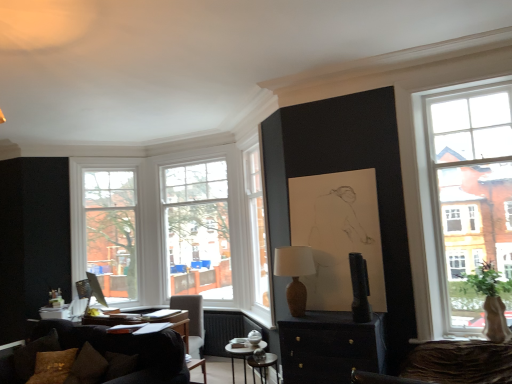
This screenshot has height=384, width=512. What do you see at coordinates (359, 288) in the screenshot?
I see `black glossy television at center` at bounding box center [359, 288].

Where is `black glossy television at center`? The image size is (512, 384). black glossy television at center is located at coordinates (359, 288).

In order to face clear glass window at left, marked as the 1th window in a left-to-right arrangement, should I rotate leftwards or rightwards?

Rotate left and turn 18.531 degrees.

Image resolution: width=512 pixels, height=384 pixels. In order to click on black glossy television at center in this screenshot , I will do `click(359, 288)`.

Between point (144, 357) and point (223, 267), which one is positioned behind?

The point (223, 267) is farther.

Locate an element on the screen. The width and height of the screenshot is (512, 384). studio couch below the clear glass window at center, which is the 2th window from left to right (from the image's perspective) is located at coordinates (127, 350).

Which object is thinner, dark brown fabric couch at lower left or clear glass window at center, which ranks as the 1th window in right-to-left order?

Thinner between the two is clear glass window at center, which ranks as the 1th window in right-to-left order.

Considering the relative sizes of dark brown fabric couch at lower left and clear glass window at center, which is the 2th window from left to right, in the image provided, is dark brown fabric couch at lower left shorter than clear glass window at center, which is the 2th window from left to right,?

Yes, dark brown fabric couch at lower left is shorter than clear glass window at center, which is the 2th window from left to right.

Is dark brown leather chair at center not inside matte brown vase at center?

dark brown leather chair at center is positioned outside matte brown vase at center.

Considering the sizes of dark brown leather chair at center and matte brown vase at center in the image, is dark brown leather chair at center taller or shorter than matte brown vase at center?

Clearly, dark brown leather chair at center is taller compared to matte brown vase at center.

From the picture: Which object is positioned more to the right, dark brown leather chair at center or matte brown vase at center?

matte brown vase at center.

Who is taller, matte black cabinet at center or clear glass window at left, which is counted as the 2th window, starting from the right?

Standing taller between the two is clear glass window at left, which is counted as the 2th window, starting from the right.

From the image's perspective, would you say matte black cabinet at center is positioned over clear glass window at left, which is counted as the 2th window, starting from the right?

No, from the image's perspective, matte black cabinet at center is not above clear glass window at left, which is counted as the 2th window, starting from the right.

Could you tell me if matte black cabinet at center is turned towards clear glass window at left, marked as the 1th window in a left-to-right arrangement?

No, matte black cabinet at center is not aimed at clear glass window at left, marked as the 1th window in a left-to-right arrangement.

This screenshot has height=384, width=512. There is a matte black cabinet at center. Identify the location of the 2nd window above it (from a real-world perspective). (105, 226).

Considering the positions of objects matte black cabinet at center and green leafy plant at right in the image provided, who is behind, matte black cabinet at center or green leafy plant at right?

matte black cabinet at center is more distant.

Is matte black cabinet at center to the left of green leafy plant at right from the viewer's perspective?

Yes.

Considering the sizes of matte black cabinet at center and green leafy plant at right in the image, is matte black cabinet at center wider or thinner than green leafy plant at right?

In the image, matte black cabinet at center appears to be wider than green leafy plant at right.

Is matte brown vase at center touching metallic silver side table at center?

matte brown vase at center and metallic silver side table at center are clearly separated.

Would you say metallic silver side table at center is part of matte brown vase at center's contents?

No, metallic silver side table at center is located outside of matte brown vase at center.

Looking at this image, is matte brown vase at center positioned before metallic silver side table at center?

Yes, it is in front of metallic silver side table at center.

Is point (113, 281) positioned after point (20, 358)?

Yes, it is behind point (20, 358).

Is clear glass window at left, marked as the 1th window in a left-to-right arrangement, further to camera compared to brown textured pillow at lower left?

Yes, it is.

In terms of height, does clear glass window at left, which is counted as the 2th window, starting from the right, look taller or shorter compared to brown textured pillow at lower left?

In the image, clear glass window at left, which is counted as the 2th window, starting from the right, appears to be taller than brown textured pillow at lower left.

At what (x,y) coordinates should I click in order to perform the action: click on pillow below the clear glass window at left, which is counted as the 2th window, starting from the right (from a real-world perspective). Please return your answer as a coordinate pair (x, y). The image size is (512, 384). Looking at the image, I should click on (33, 354).

From the image's perspective, who appears lower, metallic silver side table at center or green leafy plant at right?

From the image's view, metallic silver side table at center is below.

How far apart are metallic silver side table at center and green leafy plant at right?

The distance of metallic silver side table at center from green leafy plant at right is 2.07 meters.

Looking at this image, is metallic silver side table at center taller or shorter than green leafy plant at right?

In the image, metallic silver side table at center appears to be shorter than green leafy plant at right.

Based on the photo, choose the correct answer: Is metallic silver side table at center inside green leafy plant at right or outside it?

metallic silver side table at center is not inside green leafy plant at right, it's outside.

Locate an element on the screen. studio couch that is in front of the clear glass window at center, which is the 2th window from left to right is located at coordinates pyautogui.click(x=127, y=350).

Where is `chair located below the matte brown vase at center (from the image's perspective)`? The height and width of the screenshot is (384, 512). chair located below the matte brown vase at center (from the image's perspective) is located at coordinates (192, 327).

Which object lies further to the anchor point metallic silver side table at center, matte black cabinet at center or black glossy television at center?

Among the two, black glossy television at center is located further to metallic silver side table at center.

Which object lies further to the anchor point dark brown fabric couch at lower left, dark brown leather chair at center or clear glass window at center, which ranks as the 1th window in right-to-left order?

clear glass window at center, which ranks as the 1th window in right-to-left order, is further to dark brown fabric couch at lower left.

Which object lies further to the anchor point clear glass window at left, marked as the 1th window in a left-to-right arrangement, brown textured pillow at lower left or matte black cabinet at center?

Based on the image, matte black cabinet at center appears to be further to clear glass window at left, marked as the 1th window in a left-to-right arrangement.

From the image, which object appears to be nearer to black glossy television at center, brown textured pillow at lower left or matte brown vase at center?

The object closer to black glossy television at center is matte brown vase at center.

When comparing their distances from clear glass window at center, which ranks as the 1th window in right-to-left order, does brown textured pillow at lower left or metallic silver side table at center seem closer?

metallic silver side table at center is positioned closer to the anchor clear glass window at center, which ranks as the 1th window in right-to-left order.

From the image, which object appears to be farther from matte brown vase at center, dark brown fabric couch at lower left or black glossy television at center?

Among the two, dark brown fabric couch at lower left is located further to matte brown vase at center.

Estimate the real-world distances between objects in this image. Which object is further from matte brown vase at center, green leafy plant at right or metallic silver side table at center?

Among the two, green leafy plant at right is located further to matte brown vase at center.

Based on their spatial positions, is green leafy plant at right or matte brown vase at center further from matte black cabinet at center?

green leafy plant at right.

Locate an element on the screen. The width and height of the screenshot is (512, 384). lamp between black glossy television at center and metallic silver side table at center in the up-down direction is located at coordinates (295, 274).

Locate an element on the screen. The height and width of the screenshot is (384, 512). television between metallic silver side table at center and green leafy plant at right from left to right is located at coordinates (359, 288).

Locate an element on the screen. table located between clear glass window at left, which is counted as the 2th window, starting from the right, and black glossy television at center in the left-right direction is located at coordinates (239, 357).

Locate an element on the screen. table positioned between dark brown fabric couch at lower left and dark brown leather chair at center from near to far is located at coordinates (239, 357).